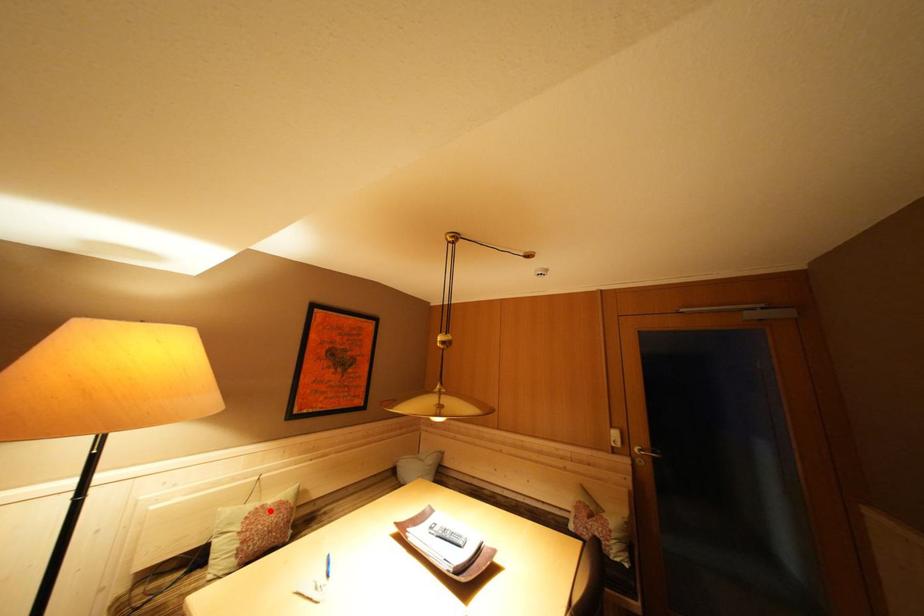
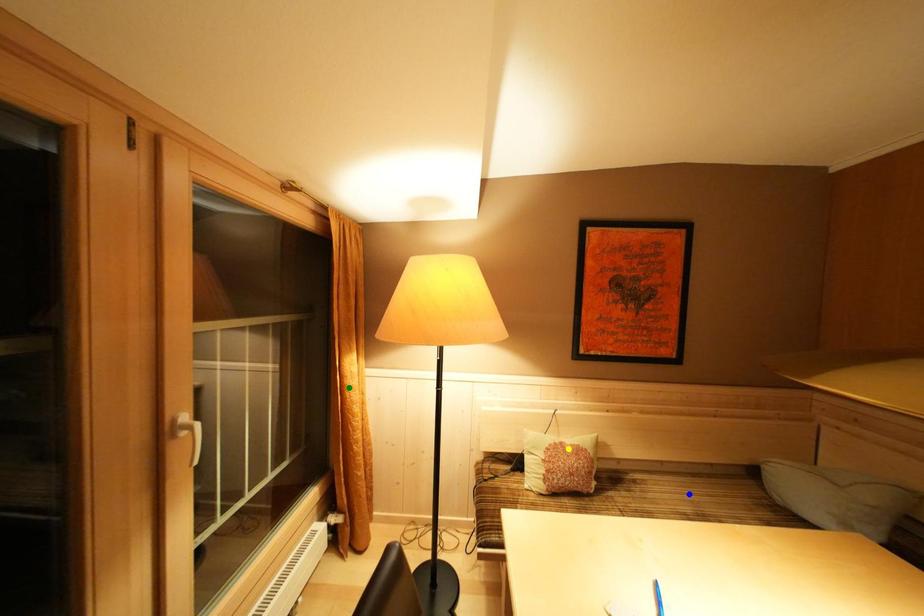
Question: I am providing you with two images of the same scene from different viewpoints. A red point is marked on the first image. You are given multiple points on the second image. Can you choose the point in image 2 that corresponds to the point in image 1?

Choices:
 (A) blue point
 (B) green point
 (C) yellow point

Answer: (C)